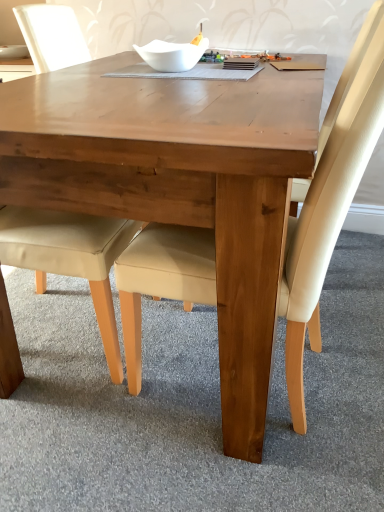
Locate an element on the screen. This screenshot has width=384, height=512. beige leather chair at lower left, which is the 2th chair from right to left is located at coordinates (70, 257).

The image size is (384, 512). I want to click on beige leather chair at center, which is the 2th chair in left-to-right order, so click(330, 197).

What do you see at coordinates (14, 52) in the screenshot?
I see `white glossy bowl at upper center` at bounding box center [14, 52].

Image resolution: width=384 pixels, height=512 pixels. In order to click on wooden table at center in this screenshot , I will do `click(178, 185)`.

From the image's perspective, is wooden table at center beneath white glossy bowl at upper center?

Correct, wooden table at center appears lower than white glossy bowl at upper center in the image.

Does wooden table at center have a smaller size compared to white glossy bowl at upper center?

Actually, wooden table at center might be larger than white glossy bowl at upper center.

Is wooden table at center positioned with its back to white glossy bowl at upper center?

No, wooden table at center is not facing away from white glossy bowl at upper center.

Is wooden table at center outside of white glossy bowl at upper center?

wooden table at center is positioned outside white glossy bowl at upper center.

Is white glossy bowl at upper center not within white glossy bowl at upper center?

Yes.

Considering the relative sizes of white glossy bowl at upper center and white glossy bowl at upper center in the image provided, is white glossy bowl at upper center taller than white glossy bowl at upper center?

No.

Which of these two, white glossy bowl at upper center or white glossy bowl at upper center, is smaller?

white glossy bowl at upper center.

Considering the relative sizes of white glossy bowl at upper center and white glossy bowl at upper center in the image provided, is white glossy bowl at upper center thinner than white glossy bowl at upper center?

Incorrect, the width of white glossy bowl at upper center is not less than that of white glossy bowl at upper center.

Is white glossy bowl at upper center situated inside beige leather chair at center, which is the 2th chair in left-to-right order, or outside?

white glossy bowl at upper center is not inside beige leather chair at center, which is the 2th chair in left-to-right order, it's outside.

Are white glossy bowl at upper center and beige leather chair at center, which is counted as the 1th chair, starting from the right, making contact?

No, white glossy bowl at upper center is not with beige leather chair at center, which is counted as the 1th chair, starting from the right.

This screenshot has width=384, height=512. What are the coordinates of `the 2nd chair positioned below the white glossy bowl at upper center (from the image's perspective)` in the screenshot? It's located at (330, 197).

Considering the relative sizes of white glossy bowl at upper center and beige leather chair at center, which is the 2th chair in left-to-right order, in the image provided, is white glossy bowl at upper center taller than beige leather chair at center, which is the 2th chair in left-to-right order,?

Incorrect, the height of white glossy bowl at upper center is not larger of that of beige leather chair at center, which is the 2th chair in left-to-right order.

How different are the orientations of beige leather chair at lower left, the first chair positioned from the left, and wooden table at center in degrees?

beige leather chair at lower left, the first chair positioned from the left, and wooden table at center are facing 93 degrees away from each other.

Is beige leather chair at lower left, which is the 2th chair from right to left, facing towards wooden table at center?

Yes, beige leather chair at lower left, which is the 2th chair from right to left, is aimed at wooden table at center.

From a real-world perspective, between beige leather chair at lower left, the first chair positioned from the left, and wooden table at center, who is vertically lower?

wooden table at center, from a real-world perspective.

Considering the relative sizes of beige leather chair at lower left, the first chair positioned from the left, and wooden table at center in the image provided, is beige leather chair at lower left, the first chair positioned from the left, shorter than wooden table at center?

In fact, beige leather chair at lower left, the first chair positioned from the left, may be taller than wooden table at center.

From the image's perspective, would you say beige leather chair at lower left, the first chair positioned from the left, is shown under beige leather chair at center, which is the 2th chair in left-to-right order?

No.

Based on the photo, measure the distance from beige leather chair at lower left, the first chair positioned from the left, to beige leather chair at center, which is counted as the 1th chair, starting from the right.

They are 13.37 inches apart.

Is beige leather chair at lower left, the first chair positioned from the left, oriented away from beige leather chair at center, which is the 2th chair in left-to-right order?

No.

Considering the sizes of objects beige leather chair at lower left, the first chair positioned from the left, and beige leather chair at center, which is counted as the 1th chair, starting from the right, in the image provided, who is smaller, beige leather chair at lower left, the first chair positioned from the left, or beige leather chair at center, which is counted as the 1th chair, starting from the right,?

beige leather chair at center, which is counted as the 1th chair, starting from the right, is smaller.

Is beige leather chair at center, which is the 2th chair in left-to-right order, in contact with beige leather chair at lower left, which is the 2th chair from right to left?

No, beige leather chair at center, which is the 2th chair in left-to-right order, is not making contact with beige leather chair at lower left, which is the 2th chair from right to left.

Between beige leather chair at center, which is counted as the 1th chair, starting from the right, and beige leather chair at lower left, which is the 2th chair from right to left, which one is positioned in front?

beige leather chair at center, which is counted as the 1th chair, starting from the right, is in front.

In terms of height, does beige leather chair at center, which is the 2th chair in left-to-right order, look taller or shorter compared to beige leather chair at lower left, which is the 2th chair from right to left?

Considering their sizes, beige leather chair at center, which is the 2th chair in left-to-right order, has less height than beige leather chair at lower left, which is the 2th chair from right to left.

What's the angular difference between beige leather chair at center, which is counted as the 1th chair, starting from the right, and beige leather chair at lower left, which is the 2th chair from right to left,'s facing directions?

The facing directions of beige leather chair at center, which is counted as the 1th chair, starting from the right, and beige leather chair at lower left, which is the 2th chair from right to left, are 171 degrees apart.

Is white glossy bowl at upper center looking in the opposite direction of beige leather chair at lower left, which is the 2th chair from right to left?

No, white glossy bowl at upper center is not facing the opposite direction of beige leather chair at lower left, which is the 2th chair from right to left.

Based on the photo, between white glossy bowl at upper center and beige leather chair at lower left, the first chair positioned from the left, which one has larger width?

With larger width is beige leather chair at lower left, the first chair positioned from the left.

From a real-world perspective, who is located higher, white glossy bowl at upper center or beige leather chair at lower left, the first chair positioned from the left?

From a 3D spatial view, white glossy bowl at upper center is above.

Based on the photo, between white glossy bowl at upper center and beige leather chair at lower left, the first chair positioned from the left, which one appears on the right side from the viewer's perspective?

beige leather chair at lower left, the first chair positioned from the left.

Where is `coffee table in front of the white glossy bowl at upper center`? This screenshot has height=512, width=384. coffee table in front of the white glossy bowl at upper center is located at coordinates (178, 185).

Identify the location of bowl lying below the white glossy bowl at upper center (from the image's perspective). This screenshot has width=384, height=512. (173, 54).

From the picture: Looking at the image, which one is located further to white glossy bowl at upper center, white glossy bowl at upper center or beige leather chair at lower left, the first chair positioned from the left?

beige leather chair at lower left, the first chair positioned from the left, lies further to white glossy bowl at upper center than the other object.

Based on their spatial positions, is beige leather chair at center, which is the 2th chair in left-to-right order, or wooden table at center further from beige leather chair at lower left, the first chair positioned from the left?

The object further to beige leather chair at lower left, the first chair positioned from the left, is wooden table at center.

Looking at the image, which one is located further to beige leather chair at center, which is the 2th chair in left-to-right order, white glossy bowl at upper center or white glossy bowl at upper center?

The object further to beige leather chair at center, which is the 2th chair in left-to-right order, is white glossy bowl at upper center.

Estimate the real-world distances between objects in this image. Which object is closer to beige leather chair at lower left, which is the 2th chair from right to left, wooden table at center or white glossy bowl at upper center?

The object closer to beige leather chair at lower left, which is the 2th chair from right to left, is wooden table at center.

When comparing their distances from white glossy bowl at upper center, does wooden table at center or beige leather chair at lower left, the first chair positioned from the left, seem further?

Among the two, beige leather chair at lower left, the first chair positioned from the left, is located further to white glossy bowl at upper center.

Which object lies further to the anchor point wooden table at center, beige leather chair at center, which is counted as the 1th chair, starting from the right, or beige leather chair at lower left, the first chair positioned from the left?

beige leather chair at lower left, the first chair positioned from the left, is further to wooden table at center.

Looking at the image, which one is located closer to white glossy bowl at upper center, beige leather chair at center, which is counted as the 1th chair, starting from the right, or white glossy bowl at upper center?

white glossy bowl at upper center.

Based on the photo, considering their positions, is beige leather chair at lower left, the first chair positioned from the left, positioned further to white glossy bowl at upper center than white glossy bowl at upper center?

Among the two, white glossy bowl at upper center is located further to white glossy bowl at upper center.

Find the location of a particular element. This screenshot has height=512, width=384. chair between beige leather chair at center, which is the 2th chair in left-to-right order, and white glossy bowl at upper center, along the z-axis is located at coordinates click(x=70, y=257).

Where is `bowl positioned between wooden table at center and white glossy bowl at upper center from near to far`? bowl positioned between wooden table at center and white glossy bowl at upper center from near to far is located at coordinates (173, 54).

You are a GUI agent. You are given a task and a screenshot of the screen. Output one action in this format:
    pyautogui.click(x=<x>, y=<y>)
    Task: Click on the bowl positioned between beige leather chair at center, which is counted as the 1th chair, starting from the right, and white glossy bowl at upper center from near to far
    
    Given the screenshot: What is the action you would take?
    pyautogui.click(x=173, y=54)

Identify the location of bowl between beige leather chair at lower left, the first chair positioned from the left, and white glossy bowl at upper center, along the z-axis. (173, 54).